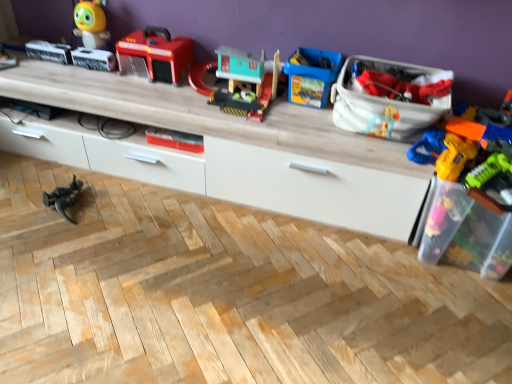
Question: Which direction should I rotate to look at matte plastic toy at center, which is the 4th toy from right to left?

Choices:
 (A) left
 (B) right

Answer: (A)

Question: Considering the relative positions of translucent plastic toy gun at right, which ranks as the 7th toy in left-to-right order, and transparent plastic toy box at right, the 2th storage box from the left, in the image provided, is translucent plastic toy gun at right, which ranks as the 7th toy in left-to-right order, in front of transparent plastic toy box at right, the 2th storage box from the left,?

Choices:
 (A) no
 (B) yes

Answer: (B)

Question: Does translucent plastic toy gun at right, which ranks as the 7th toy in left-to-right order, have a smaller size compared to transparent plastic toy box at right, marked as the first storage box in a right-to-left arrangement?

Choices:
 (A) no
 (B) yes

Answer: (A)

Question: Is translucent plastic toy gun at right, which ranks as the 7th toy in left-to-right order, far away from transparent plastic toy box at right, the 2th storage box from the left?

Choices:
 (A) yes
 (B) no

Answer: (B)

Question: Does translucent plastic toy gun at right, which ranks as the 7th toy in left-to-right order, have a larger size compared to transparent plastic toy box at right, the 2th storage box from the left?

Choices:
 (A) no
 (B) yes

Answer: (B)

Question: Is translucent plastic toy gun at right, positioned as the first toy in right-to-left order, taller than transparent plastic toy box at right, marked as the first storage box in a right-to-left arrangement?

Choices:
 (A) yes
 (B) no

Answer: (B)

Question: Is translucent plastic toy gun at right, which ranks as the 7th toy in left-to-right order, positioned behind transparent plastic toy box at right, the 2th storage box from the left?

Choices:
 (A) no
 (B) yes

Answer: (A)

Question: Considering the relative positions of matte plastic toy at center, which is the 4th toy from right to left, and blue plastic toy at center, the 2th toy from the right, in the image provided, is matte plastic toy at center, which is the 4th toy from right to left, to the left of blue plastic toy at center, the 2th toy from the right, from the viewer's perspective?

Choices:
 (A) yes
 (B) no

Answer: (A)

Question: Could you tell me if matte plastic toy at center, which is the 4th toy from right to left, is facing blue plastic toy at center, the 2th toy from the right?

Choices:
 (A) no
 (B) yes

Answer: (A)

Question: From the image's perspective, is matte plastic toy at center, which is counted as the fourth toy, starting from the left, located above blue plastic toy at center, marked as the 6th toy in a left-to-right arrangement?

Choices:
 (A) no
 (B) yes

Answer: (A)

Question: Can we say matte plastic toy at center, which is counted as the fourth toy, starting from the left, lies outside blue plastic toy at center, the 2th toy from the right?

Choices:
 (A) yes
 (B) no

Answer: (A)

Question: Is matte plastic toy at center, which is the 4th toy from right to left, wider than blue plastic toy at center, marked as the 6th toy in a left-to-right arrangement?

Choices:
 (A) yes
 (B) no

Answer: (B)

Question: Is the depth of matte plastic toy at center, which is the 4th toy from right to left, greater than that of blue plastic toy at center, marked as the 6th toy in a left-to-right arrangement?

Choices:
 (A) no
 (B) yes

Answer: (B)

Question: Is matte plastic fire truck at upper center, which is the 5th toy from right to left, with black plastic dinosaur at lower left, which is the first toy from left to right?

Choices:
 (A) yes
 (B) no

Answer: (B)